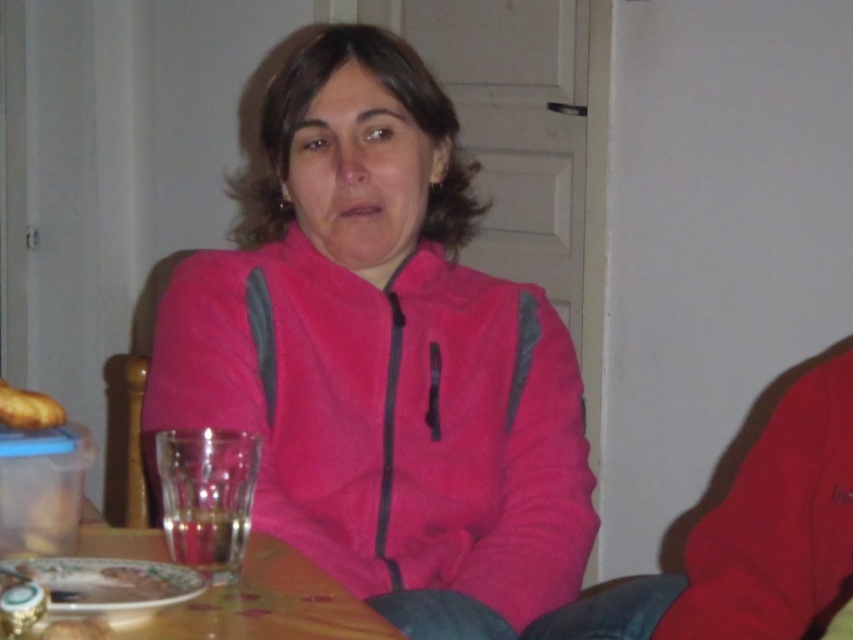
You are a server in a restaurant and need to place a new dish on the wooden table at lower center. The dish is as wide as the golden brown bread at left. Will it fit on the table?

The wooden table at lower center is wider than the golden brown bread at left, so the dish will fit since the table is wider than the bread.

You are a customer at a cafe and you want to place your order. You see the pink fleece jacket at center and the wooden table at lower center. Which object should you interact with to place your order?

You should interact with the wooden table at lower center to place your order because the pink fleece jacket at center is located above it and likely belongs to the person sitting there, not the server.

You are a tailor measuring for a jacket. You have a golden brown bread at left on the table and a pink fleece jacket at center. Which object is bigger in size?

The pink fleece jacket at center is larger in size than the golden brown bread at left.